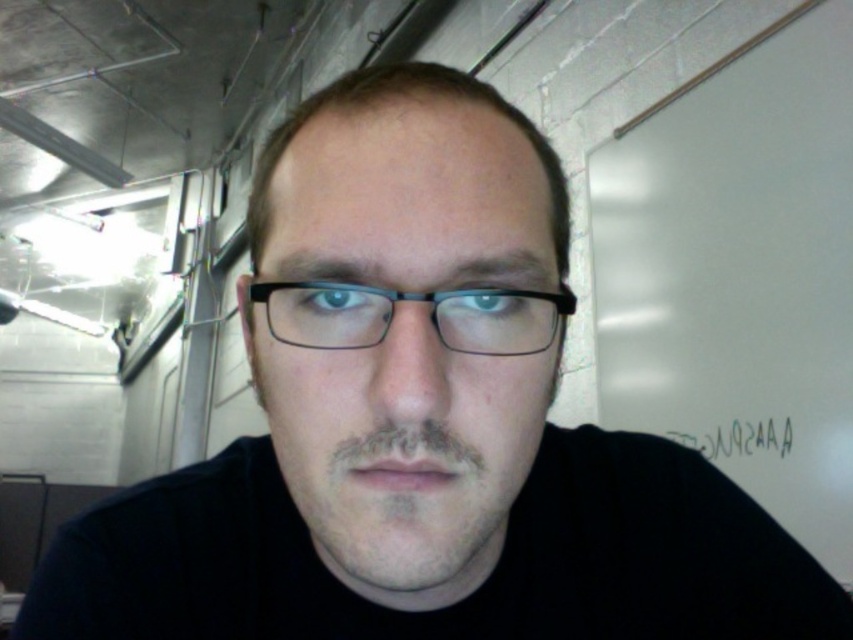
You are a photographer setting up a shoot in an industrial workspace. You notice a person in front of you with dark brown stubble at center and black paper at lower right. To ensure proper framing, which object is positioned to the left of the other?

The dark brown stubble at center is to the left of the black paper at lower right.

You are a photographer adjusting the focus of your camera. You notice two elements in the frame that need to be in focus simultaneously. The dark brown stubble at center and the black paper at lower right. Which element would require a smaller depth of field to capture both in focus?

The dark brown stubble at center is thinner than the black paper at lower right, so to capture both in focus, the smaller depth of field would need to accommodate the thinner element. However, depth of field is inversely related to the aperture size. A smaller aperture would allow a larger depth of field, so a smaller aperture would be better. Wait, the question is about which element requires a smaller depth of field. Hmm, maybe I need to think differently. Since the stubble is thinner, perhaps it has less